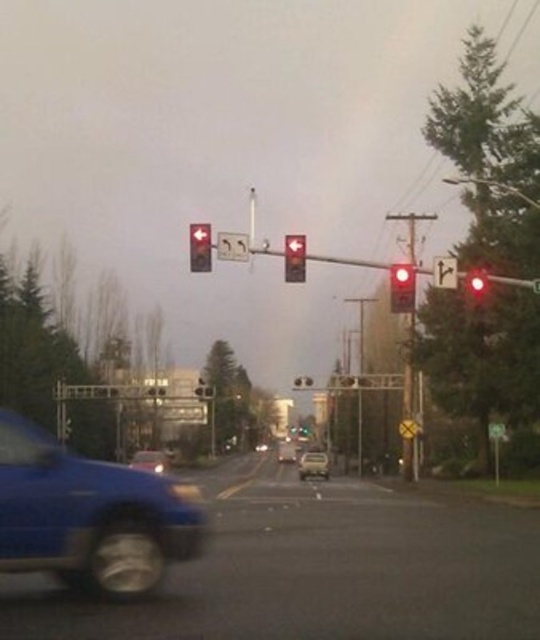
Based on the photo, which is above, matte silver suv at center or metallic red traffic light at upper center?

metallic red traffic light at upper center

Does matte silver suv at center appear on the right side of metallic red traffic light at upper center?

Yes, matte silver suv at center is to the right of metallic red traffic light at upper center.

Locate an element on the screen. This screenshot has height=640, width=540. matte silver suv at center is located at coordinates (286, 451).

Which of these two, matte red traffic light at right or metallic silver sedan at center, stands taller?

matte red traffic light at right

What do you see at coordinates (401, 288) in the screenshot? The image size is (540, 640). I see `matte red traffic light at right` at bounding box center [401, 288].

Locate an element on the screen. This screenshot has width=540, height=640. matte red traffic light at right is located at coordinates (401, 288).

Consider the image. Is blue matte car at lower left further to the viewer compared to metallic silver traffic light at center?

No, blue matte car at lower left is closer to the viewer.

Who is positioned more to the left, blue matte car at lower left or metallic silver traffic light at center?

blue matte car at lower left is more to the left.

Is point (153, 454) positioned before point (299, 381)?

That is True.

Locate an element on the screen. blue matte car at lower left is located at coordinates (150, 460).